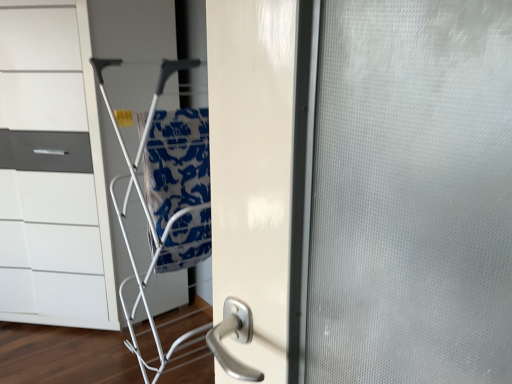
In order to face silver metallic door handle at center, should I rotate leftwards or rightwards?

To face it directly, rotate left by 4.004 degrees.

What are the coordinates of `blue printed fabric at center` in the screenshot? It's located at (176, 163).

Between blue printed fabric at center and silver metallic door handle at center, which one has smaller size?

silver metallic door handle at center is smaller.

Based on the photo, from the image's perspective, is blue printed fabric at center above silver metallic door handle at center?

Yes, from the image's perspective, blue printed fabric at center is over silver metallic door handle at center.

Considering the relative sizes of blue printed fabric at center and silver metallic door handle at center in the image provided, is blue printed fabric at center wider than silver metallic door handle at center?

Indeed, blue printed fabric at center has a greater width compared to silver metallic door handle at center.

Is point (183, 224) farther from viewer compared to point (242, 317)?

Yes, it is.

Would you consider blue printed fabric at center to be distant from white glossy chest of drawers at left?

Actually, blue printed fabric at center and white glossy chest of drawers at left are a little close together.

In the scene shown: Is blue printed fabric at center at the left side of white glossy chest of drawers at left?

No.

Is blue printed fabric at center taller or shorter than white glossy chest of drawers at left?

Considering their sizes, blue printed fabric at center has less height than white glossy chest of drawers at left.

Does blue printed fabric at center come in front of white glossy chest of drawers at left?

Yes.

Which is more distant, (x=228, y=313) or (x=209, y=196)?

The point (x=209, y=196) is farther.

Is silver metallic door handle at center to the left or to the right of blue printed fabric at center in the image?

Clearly, silver metallic door handle at center is on the right of blue printed fabric at center in the image.

Is silver metallic door handle at center bigger or smaller than blue printed fabric at center?

silver metallic door handle at center is smaller than blue printed fabric at center.

From a real-world perspective, is silver metallic door handle at center beneath blue printed fabric at center?

Correct, in the physical world, silver metallic door handle at center is lower than blue printed fabric at center.

From the image's perspective, is white glossy chest of drawers at left above or below blue printed fabric at center?

white glossy chest of drawers at left is situated higher than blue printed fabric at center in the image.

Is white glossy chest of drawers at left to the left of blue printed fabric at center from the viewer's perspective?

Yes, white glossy chest of drawers at left is to the left of blue printed fabric at center.

Does white glossy chest of drawers at left have a larger size compared to blue printed fabric at center?

Yes, white glossy chest of drawers at left is bigger than blue printed fabric at center.

In the scene shown: From a real-world perspective, between white glossy chest of drawers at left and blue printed fabric at center, who is vertically lower?

white glossy chest of drawers at left is physically lower.

Is silver metallic door handle at center touching white glossy chest of drawers at left?

silver metallic door handle at center and white glossy chest of drawers at left are clearly separated.

Is silver metallic door handle at center to the right of white glossy chest of drawers at left from the viewer's perspective?

Correct, you'll find silver metallic door handle at center to the right of white glossy chest of drawers at left.

Is silver metallic door handle at center looking in the opposite direction of white glossy chest of drawers at left?

That's not correct — silver metallic door handle at center is not looking away from white glossy chest of drawers at left.

Consider the image. Is white glossy chest of drawers at left touching silver metallic door handle at center?

No, white glossy chest of drawers at left is not touching silver metallic door handle at center.

Choose the correct answer: Is white glossy chest of drawers at left inside silver metallic door handle at center or outside it?

white glossy chest of drawers at left is outside silver metallic door handle at center.

Is white glossy chest of drawers at left bigger than silver metallic door handle at center?

Yes, white glossy chest of drawers at left is bigger than silver metallic door handle at center.

Locate an element on the screen. The height and width of the screenshot is (384, 512). door handle on the right of blue printed fabric at center is located at coordinates (236, 339).

I want to click on blanket that appears below the white glossy chest of drawers at left (from the image's perspective), so click(176, 163).

Based on their spatial positions, is silver metallic door handle at center or blue printed fabric at center further from white glossy chest of drawers at left?

Based on the image, silver metallic door handle at center appears to be further to white glossy chest of drawers at left.

When comparing their distances from silver metallic door handle at center, does white glossy chest of drawers at left or blue printed fabric at center seem further?

white glossy chest of drawers at left lies further to silver metallic door handle at center than the other object.

When comparing their distances from white glossy chest of drawers at left, does blue printed fabric at center or silver metallic door handle at center seem closer?

blue printed fabric at center is closer to white glossy chest of drawers at left.

Considering their positions, is blue printed fabric at center positioned closer to silver metallic door handle at center than white glossy chest of drawers at left?

blue printed fabric at center lies closer to silver metallic door handle at center than the other object.

When comparing their distances from blue printed fabric at center, does silver metallic door handle at center or white glossy chest of drawers at left seem further?

silver metallic door handle at center is positioned further to the anchor blue printed fabric at center.

Considering their positions, is white glossy chest of drawers at left positioned closer to blue printed fabric at center than silver metallic door handle at center?

white glossy chest of drawers at left is positioned closer to the anchor blue printed fabric at center.

The width and height of the screenshot is (512, 384). Identify the location of blanket between white glossy chest of drawers at left and silver metallic door handle at center in the vertical direction. (176, 163).